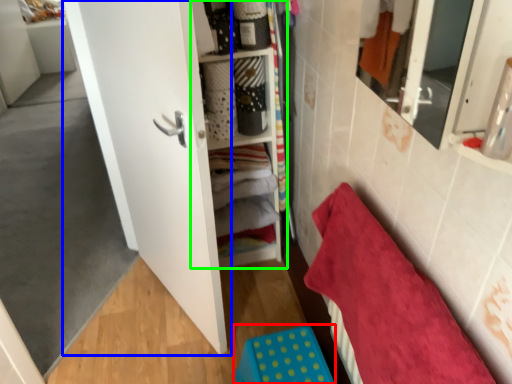
Question: Which object is positioned farthest from step stool (highlighted by a red box)? Select from door (highlighted by a blue box) and cabinet (highlighted by a green box).

Choices:
 (A) door
 (B) cabinet

Answer: (B)